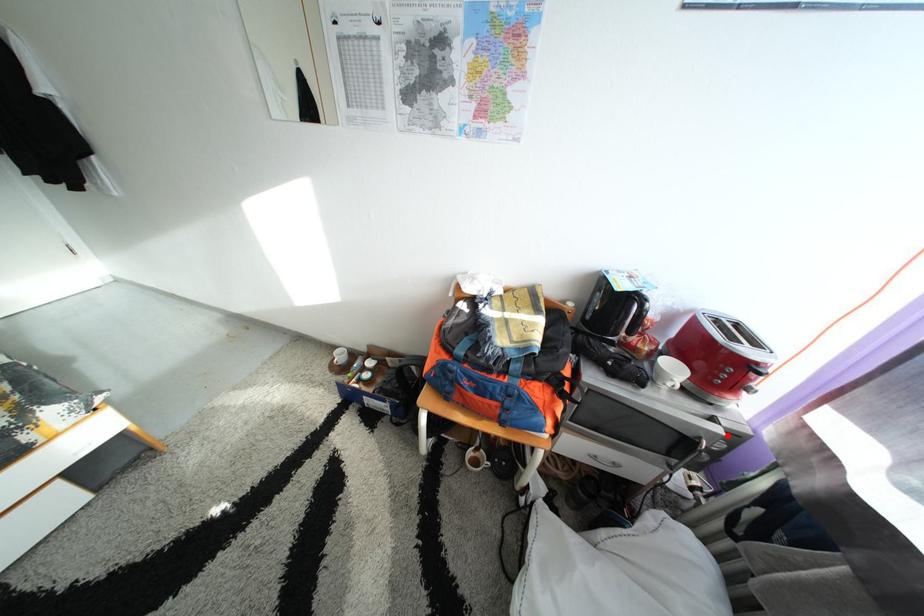
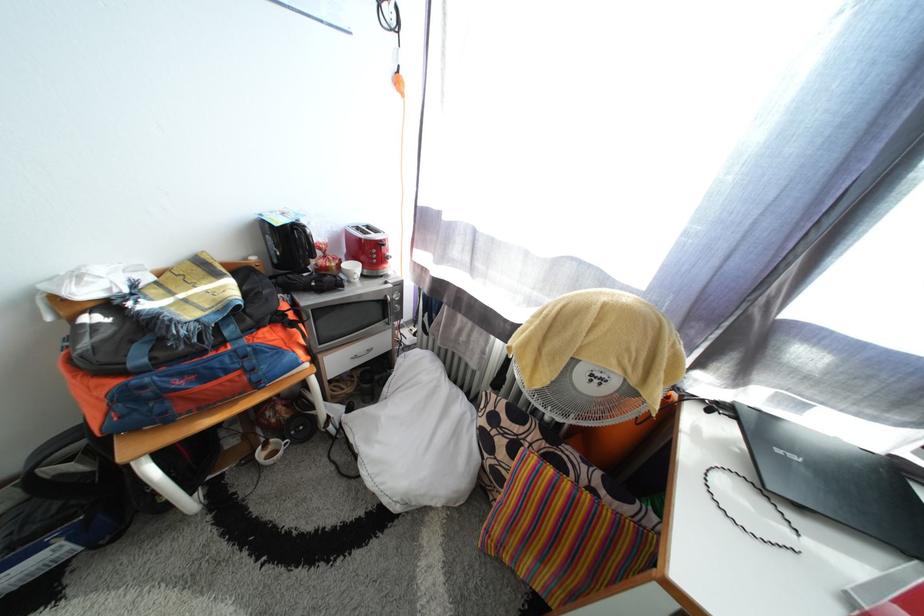
The point at the highlighted location is marked in the first image. Where is the corresponding point in the second image?

(398, 293)